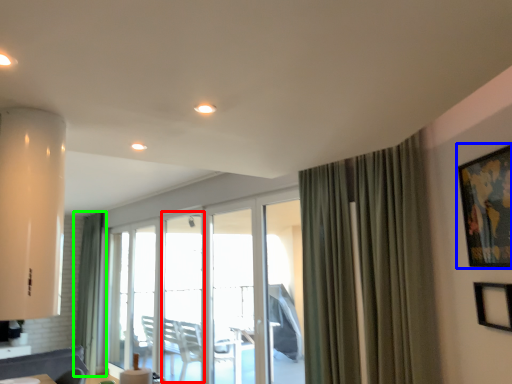
Question: Which is nearer to the window (highlighted by a red box)? picture frame (highlighted by a blue box) or curtain (highlighted by a green box).

Choices:
 (A) picture frame
 (B) curtain

Answer: (B)